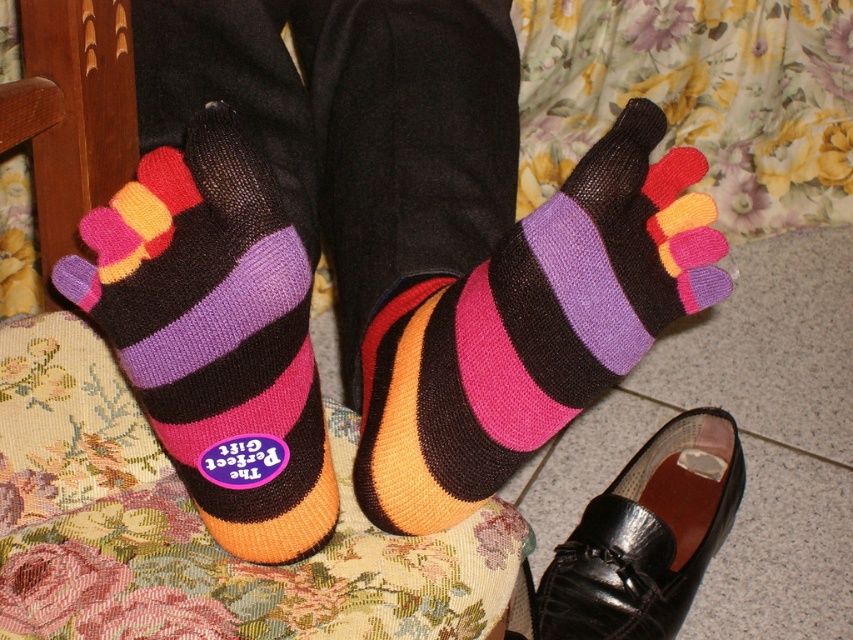
You are trying to place a small decorative item on the floor between the two points labeled point (675, 314) and point (283, 509). Based on their positions, which point should the item be closer to if it needs to be in front of the other point?

The item should be closer to point (283, 509) because point (675, 314) is behind point (283, 509), so placing it near the front point would ensure it is in front.

Based on the photo, based on the coordinates provided, what object is located at point (376,268) in the image?

The point (376,268) indicates knitted striped socks at center.

You are organizing a closet and need to place the multicolored knitted sock at center and the black leather shoe at lower right. According to the image, which item is positioned higher?

The multicolored knitted sock at center is located above the black leather shoe at lower right, so it is positioned higher.